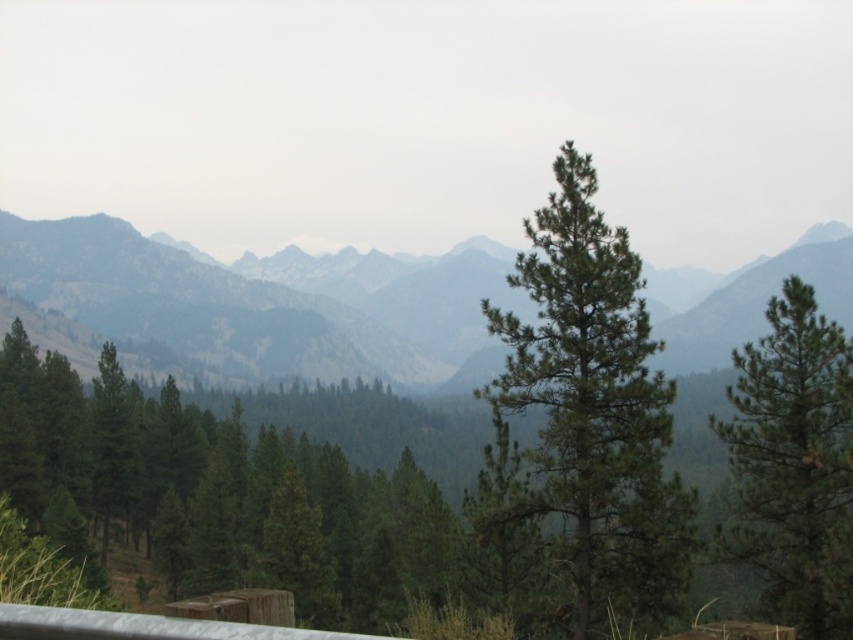
Question: Does green needle-like tree at center have a lesser width compared to silver metallic rail at lower left?

Choices:
 (A) yes
 (B) no

Answer: (B)

Question: Can you confirm if green needle-like tree at center is positioned above green needle-like tree at right?

Choices:
 (A) yes
 (B) no

Answer: (A)

Question: Which point appears closest to the camera in this image?

Choices:
 (A) (62, 637)
 (B) (334, 276)
 (C) (519, 262)
 (D) (824, 413)

Answer: (A)

Question: Estimate the real-world distances between objects in this image. Which object is farther from the silver metallic rail at lower left?

Choices:
 (A) green needle-like tree at right
 (B) green needle-like tree at center
 (C) gray textured mountains at center

Answer: (C)

Question: Is green needle-like tree at right to the right of silver metallic rail at lower left from the viewer's perspective?

Choices:
 (A) yes
 (B) no

Answer: (A)

Question: Which of these objects is positioned farthest from the green needle-like tree at right?

Choices:
 (A) green needle-like tree at center
 (B) silver metallic rail at lower left
 (C) gray textured mountains at center

Answer: (C)